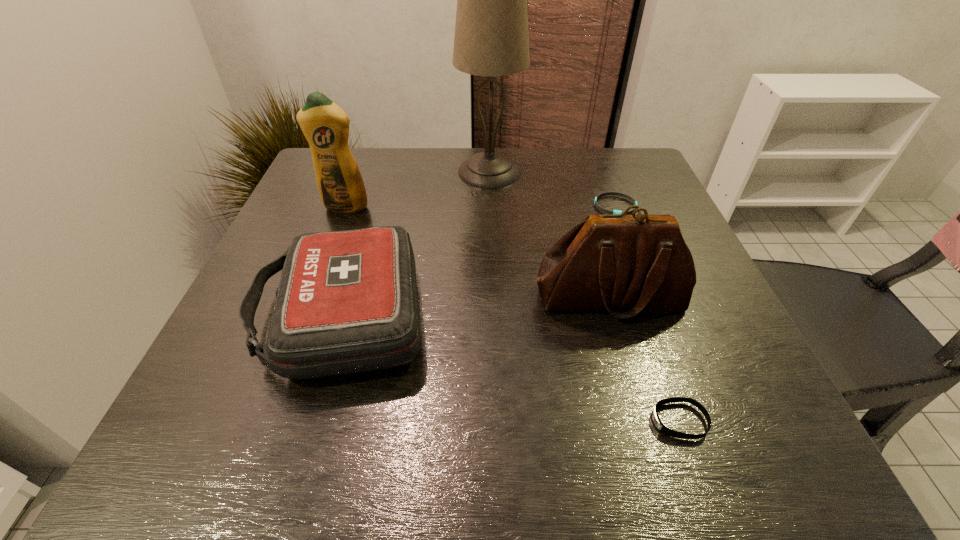
Locate an element on the screen. The width and height of the screenshot is (960, 540). lampshade is located at coordinates (491, 39).

Where is `the farthest object`? This screenshot has height=540, width=960. the farthest object is located at coordinates (491, 39).

The image size is (960, 540). In order to click on detergent in this screenshot , I will do `click(325, 125)`.

Where is `the third tallest object`? The image size is (960, 540). the third tallest object is located at coordinates (635, 263).

Identify the location of the fourth tallest object. (347, 302).

Find the location of `the nearer wristband`. the nearer wristband is located at coordinates (662, 428).

Where is `the nearest object`? Image resolution: width=960 pixels, height=540 pixels. the nearest object is located at coordinates (662, 428).

This screenshot has height=540, width=960. I want to click on the shortest object, so click(626, 196).

Find the location of a particular element. the farther wristband is located at coordinates (626, 196).

Find the location of a particular element. vacant space located on the front-facing side of the farthest object is located at coordinates (386, 172).